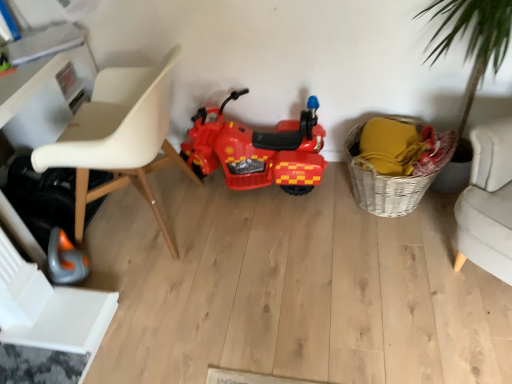
Question: Is white plastic chair at left behind white plastic swivel chair at lower left?

Choices:
 (A) yes
 (B) no

Answer: (B)

Question: Is white plastic chair at left oriented away from white plastic swivel chair at lower left?

Choices:
 (A) no
 (B) yes

Answer: (A)

Question: Could white plastic swivel chair at lower left be considered to be inside white plastic chair at left?

Choices:
 (A) yes
 (B) no

Answer: (B)

Question: Is white plastic chair at left shorter than white plastic swivel chair at lower left?

Choices:
 (A) no
 (B) yes

Answer: (A)

Question: Is white plastic chair at left taller than white plastic swivel chair at lower left?

Choices:
 (A) no
 (B) yes

Answer: (B)

Question: Is white plastic chair at left aimed at white plastic swivel chair at lower left?

Choices:
 (A) no
 (B) yes

Answer: (A)

Question: Would you consider shiny plastic motorcycle at center to be distant from white plastic chair at left?

Choices:
 (A) yes
 (B) no

Answer: (B)

Question: Is shiny plastic motorcycle at center positioned behind white plastic chair at left?

Choices:
 (A) yes
 (B) no

Answer: (A)

Question: Can you confirm if shiny plastic motorcycle at center is positioned to the left of white plastic chair at left?

Choices:
 (A) yes
 (B) no

Answer: (B)

Question: Is shiny plastic motorcycle at center taller than white plastic chair at left?

Choices:
 (A) no
 (B) yes

Answer: (A)

Question: Is shiny plastic motorcycle at center smaller than white plastic chair at left?

Choices:
 (A) no
 (B) yes

Answer: (B)

Question: Considering the relative sizes of shiny plastic motorcycle at center and white plastic chair at left in the image provided, is shiny plastic motorcycle at center shorter than white plastic chair at left?

Choices:
 (A) yes
 (B) no

Answer: (A)

Question: Is shiny plastic motorcycle at center taller than white plastic swivel chair at lower left?

Choices:
 (A) yes
 (B) no

Answer: (A)